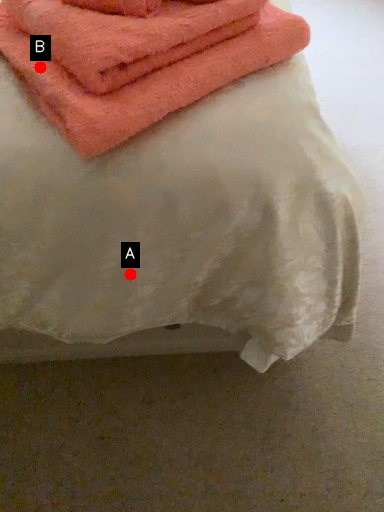
Question: Two points are circled on the image, labeled by A and B beside each circle. Which of the following is the farthest from the observer?

Choices:
 (A) A is further
 (B) B is further

Answer: (A)